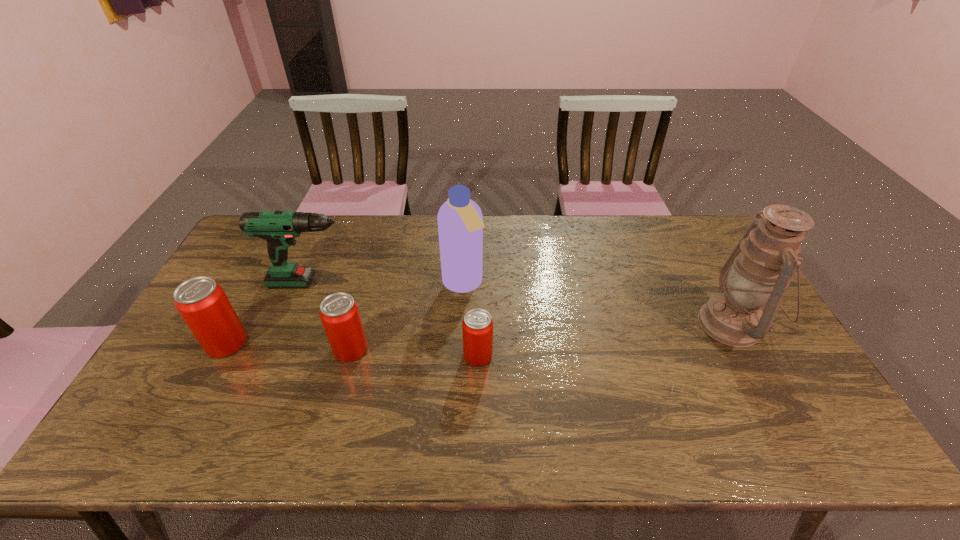
Where is `blank space located 0.390m on the left of the shortest object`? This screenshot has height=540, width=960. blank space located 0.390m on the left of the shortest object is located at coordinates (319, 356).

At what (x,y) coordinates should I click in order to perform the action: click on free space located 0.250m on the handle side of the third tallest object. Please return your answer as a coordinate pair (x, y). Looking at the image, I should click on (446, 282).

Locate an element on the screen. vacant area situated on the back of the rightmost object is located at coordinates (708, 282).

You are a GUI agent. You are given a task and a screenshot of the screen. Output one action in this format:
    pyautogui.click(x=<x>, y=<y>)
    Task: Click on the blank space located on the front of the second tallest object
    Image resolution: width=960 pixels, height=540 pixels.
    Given the screenshot: What is the action you would take?
    pyautogui.click(x=458, y=402)

Image resolution: width=960 pixels, height=540 pixels. Identify the location of can at the left edge. (202, 303).

At what (x,y) coordinates should I click in order to perform the action: click on drill positioned at the left edge. Please return your answer as a coordinate pair (x, y). Looking at the image, I should click on (279, 228).

What are the coordinates of `object present at the right edge` in the screenshot? It's located at (759, 271).

Where is `vacant space at the far edge of the desktop`? This screenshot has height=540, width=960. vacant space at the far edge of the desktop is located at coordinates (433, 238).

You are a GUI agent. You are given a task and a screenshot of the screen. Output one action in this format:
    pyautogui.click(x=<x>, y=<y>)
    Task: Click on the free space at the near edge of the desktop
    The image size is (960, 540).
    Given the screenshot: What is the action you would take?
    pyautogui.click(x=492, y=398)

The width and height of the screenshot is (960, 540). In the image, there is a desktop. In order to click on free region at the left edge in this screenshot , I will do `click(245, 269)`.